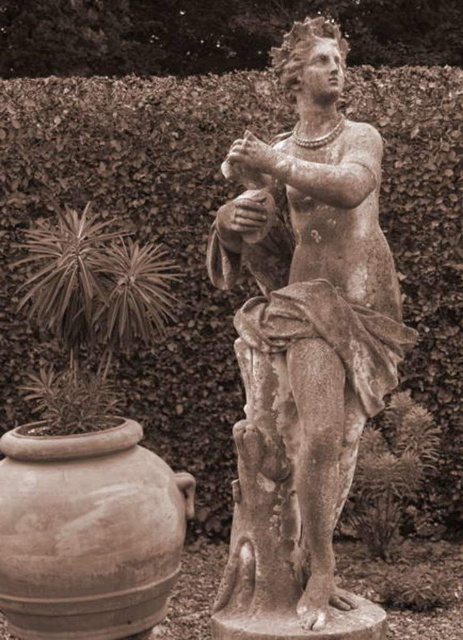
Can you confirm if green leafy hedge at upper center is shorter than stone statue at center?

No, green leafy hedge at upper center is not shorter than stone statue at center.

Does green leafy hedge at upper center have a lesser width compared to stone statue at center?

No, green leafy hedge at upper center is not thinner than stone statue at center.

The height and width of the screenshot is (640, 463). I want to click on green leafy hedge at upper center, so click(x=139, y=236).

How distant is green leafy hedge at upper center from brown clay vase at lower left?

They are 1.43 meters apart.

How distant is green leafy hedge at upper center from brown clay vase at lower left?

green leafy hedge at upper center is 4.68 feet from brown clay vase at lower left.

Is point (220, 342) less distant than point (108, 580)?

No, (220, 342) is further to viewer.

Where is `green leafy hedge at upper center`? green leafy hedge at upper center is located at coordinates (139, 236).

Locate an element on the screen. stone statue at center is located at coordinates (313, 291).

Between stone statue at center and brown clay vase at lower left, which one is positioned lower?

brown clay vase at lower left

Is point (255, 227) more distant than point (163, 528)?

No, (255, 227) is in front of (163, 528).

Locate an element on the screen. stone statue at center is located at coordinates 313,291.